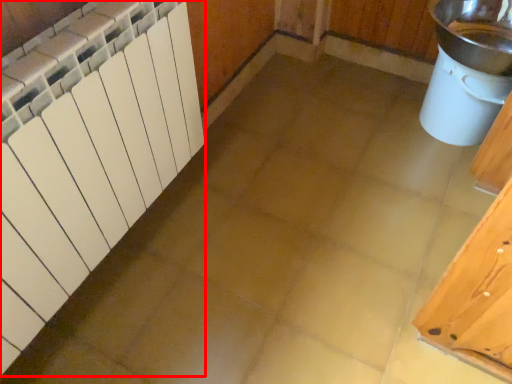
Question: From the image's perspective, where is radiator (annotated by the red box) located relative to sink?

Choices:
 (A) above
 (B) below

Answer: (B)